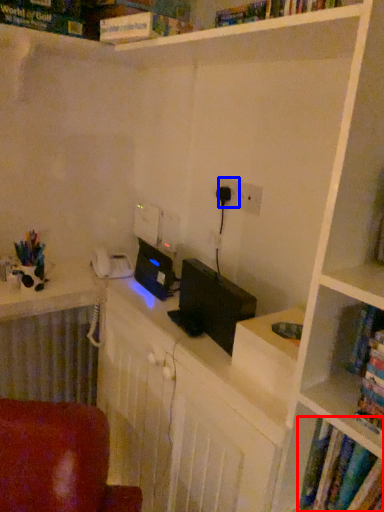
Question: Which object is further to the camera taking this photo, book (highlighted by a red box) or electric outlet (highlighted by a blue box)?

Choices:
 (A) book
 (B) electric outlet

Answer: (B)